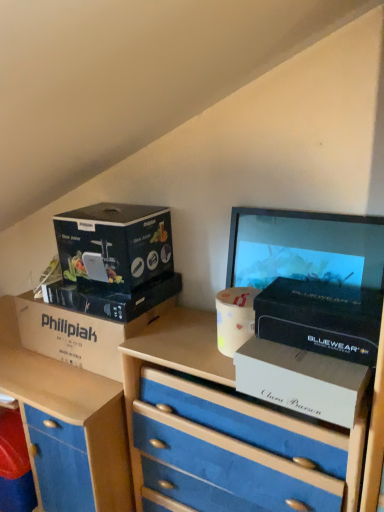
Question: Does matte black box at upper left, positioned as the second box in left-to-right order, appear on the right side of blue fabric chest of drawers at center?

Choices:
 (A) yes
 (B) no

Answer: (B)

Question: Considering the relative sizes of matte black box at upper left, positioned as the second box in left-to-right order, and blue fabric chest of drawers at center in the image provided, is matte black box at upper left, positioned as the second box in left-to-right order, bigger than blue fabric chest of drawers at center?

Choices:
 (A) yes
 (B) no

Answer: (B)

Question: From a real-world perspective, is matte black box at upper left, the fourth box positioned from the right, located higher than blue fabric chest of drawers at center?

Choices:
 (A) yes
 (B) no

Answer: (A)

Question: Is the depth of matte black box at upper left, positioned as the second box in left-to-right order, less than that of blue fabric chest of drawers at center?

Choices:
 (A) yes
 (B) no

Answer: (B)

Question: Is matte black box at upper left, positioned as the second box in left-to-right order, completely or partially outside of blue fabric chest of drawers at center?

Choices:
 (A) no
 (B) yes

Answer: (B)

Question: Considering the relative positions of matte black box at upper left, positioned as the second box in left-to-right order, and blue fabric chest of drawers at center in the image provided, is matte black box at upper left, positioned as the second box in left-to-right order, to the left of blue fabric chest of drawers at center from the viewer's perspective?

Choices:
 (A) no
 (B) yes

Answer: (B)

Question: Is black matte box at center-right, which appears as the 1th box when viewed from the right, positioned behind white cardboard box at left, the first box positioned from the left?

Choices:
 (A) yes
 (B) no

Answer: (B)

Question: Is the surface of black matte box at center-right, which is the fifth box in left-to-right order, in direct contact with white cardboard box at left, the first box positioned from the left?

Choices:
 (A) no
 (B) yes

Answer: (A)

Question: Does black matte box at center-right, which appears as the 1th box when viewed from the right, have a smaller size compared to white cardboard box at left, marked as the fifth box in a right-to-left arrangement?

Choices:
 (A) yes
 (B) no

Answer: (A)

Question: Is black matte box at center-right, which is the fifth box in left-to-right order, outside of white cardboard box at left, marked as the fifth box in a right-to-left arrangement?

Choices:
 (A) no
 (B) yes

Answer: (B)

Question: Is the depth of black matte box at center-right, which is the fifth box in left-to-right order, less than that of white cardboard box at left, the first box positioned from the left?

Choices:
 (A) no
 (B) yes

Answer: (B)

Question: Is black matte box at center-right, which appears as the 1th box when viewed from the right, far from white cardboard box at left, the first box positioned from the left?

Choices:
 (A) yes
 (B) no

Answer: (B)

Question: Is matte black box at upper left, the fourth box positioned from the right, at the left side of blue matte drawer at lower left?

Choices:
 (A) no
 (B) yes

Answer: (A)